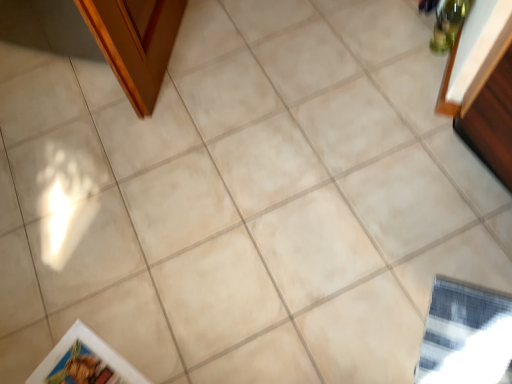
Where is `free space in front of green glass bottle at upper right`? The width and height of the screenshot is (512, 384). free space in front of green glass bottle at upper right is located at coordinates (433, 74).